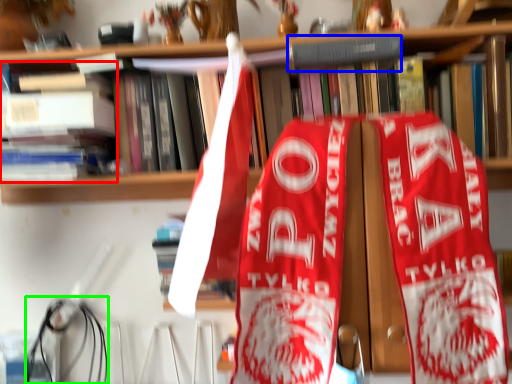
Question: Estimate the real-world distances between objects in this image. Which object is farther from book (highlighted by a red box), book (highlighted by a blue box) or wire (highlighted by a green box)?

Choices:
 (A) book
 (B) wire

Answer: (A)